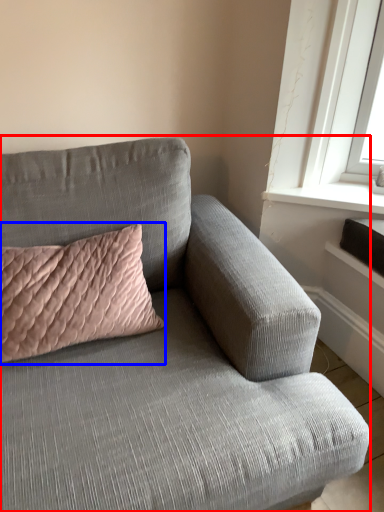
Question: Which object is further to the camera taking this photo, studio couch (highlighted by a red box) or pillow (highlighted by a blue box)?

Choices:
 (A) studio couch
 (B) pillow

Answer: (B)